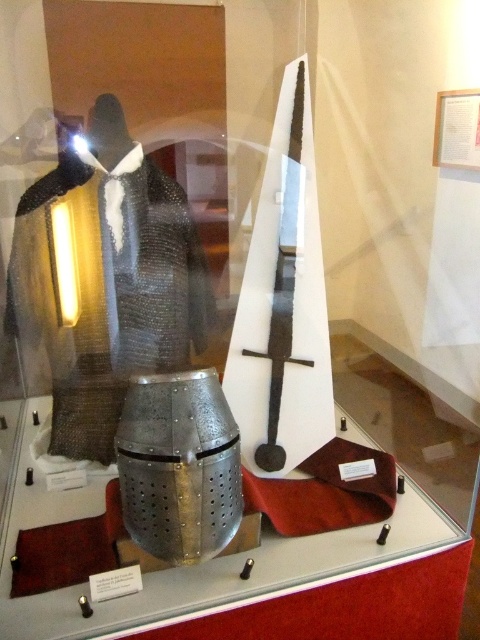
You are a museum curator checking the display case. You need to ensure that the chainmail armor at left and the polished steel sword at center are visible to visitors. Given their sizes, which object might require more space in the display case?

The chainmail armor at left has a larger size compared to the polished steel sword at center, so it requires more space in the display case.

You are a museum visitor standing in front of the display case. You notice a point marked at coordinates (x=106, y=280). What object is located at that point?

The point at coordinates (x=106, y=280) indicates the chainmail armor at left.

You are a museum visitor standing in front of the display case. You notice the chainmail armor at left and the polished silver helmet at center. Which object occupies more horizontal space in the display?

The chainmail armor at left might be wider than the polished silver helmet at center, so it likely occupies more horizontal space in the display.